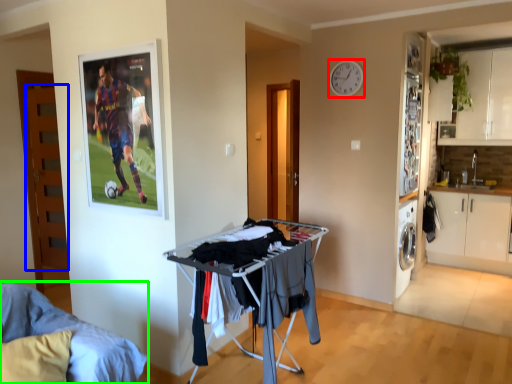
Question: Which object is the closest to the clock (highlighted by a red box)? Choose among these: door (highlighted by a blue box) or furniture (highlighted by a green box).

Choices:
 (A) door
 (B) furniture

Answer: (A)